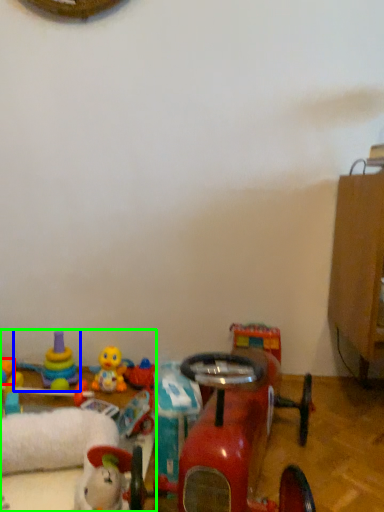
Question: Based on their relative distances, which object is nearer to toy (highlighted by a red box)? Choose from toy (highlighted by a blue box) and toy (highlighted by a green box).

Choices:
 (A) toy
 (B) toy

Answer: (A)